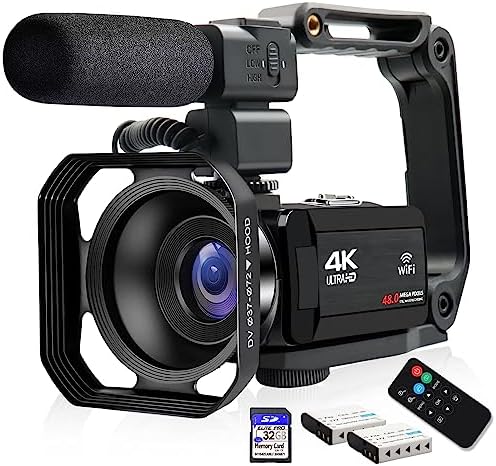
You are a GUI agent. You are given a task and a screenshot of the screen. Output one action in this format:
    pyautogui.click(x=<x>, y=<y>)
    Task: Click on the mic
    This screenshot has height=466, width=496.
    Given the screenshot: What is the action you would take?
    (85, 91)